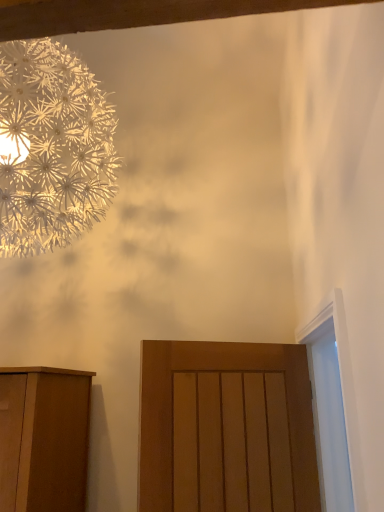
Question: From the image's perspective, is white glossy door at right positioned above or below metallic silver flower at upper left?

Choices:
 (A) above
 (B) below

Answer: (B)

Question: Is white glossy door at right taller or shorter than metallic silver flower at upper left?

Choices:
 (A) tall
 (B) short

Answer: (B)

Question: Which of these objects is positioned closest to the white glossy door at right?

Choices:
 (A) matte wood door at center
 (B) metallic silver flower at upper left

Answer: (A)

Question: Considering the real-world distances, which object is closest to the metallic silver flower at upper left?

Choices:
 (A) white glossy door at right
 (B) matte wood door at center

Answer: (B)